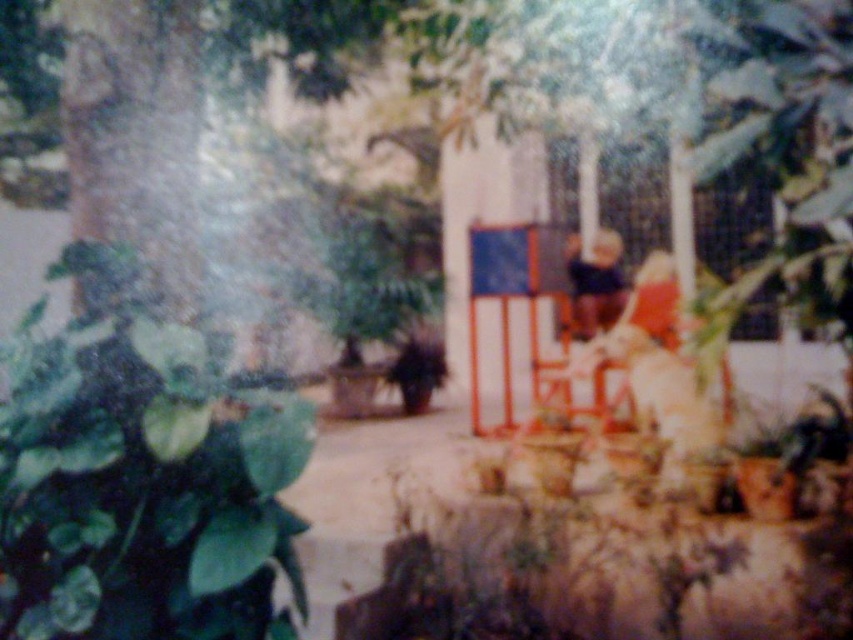
Does wooden chair at center have a smaller size compared to dark blue fabric at center?

No, wooden chair at center is not smaller than dark blue fabric at center.

In the scene shown: Who is more forward, (659, 337) or (604, 237)?

Positioned in front is point (659, 337).

At what (x,y) coordinates should I click in order to perform the action: click on wooden chair at center. Please return your answer as a coordinate pair (x, y). This screenshot has height=640, width=853. Looking at the image, I should click on (616, 346).

Is point (288, 515) positioned before point (544, 365)?

Yes, point (288, 515) is closer to viewer.

From the picture: Can you confirm if green matte leaf at lower left is wider than wooden chair at center?

Incorrect, green matte leaf at lower left's width does not surpass wooden chair at center's.

In order to click on green matte leaf at lower left in this screenshot , I will do `click(140, 474)`.

Who is lower down, green matte leaf at lower left or dark blue fabric at center?

green matte leaf at lower left is below.

Does point (212, 445) come closer to viewer compared to point (579, 337)?

Yes, point (212, 445) is in front of point (579, 337).

The image size is (853, 640). In order to click on green matte leaf at lower left in this screenshot , I will do `click(140, 474)`.